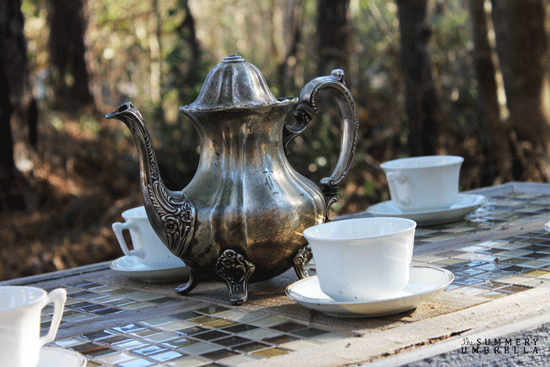
In order to click on cup in this screenshot , I will do `click(20, 334)`.